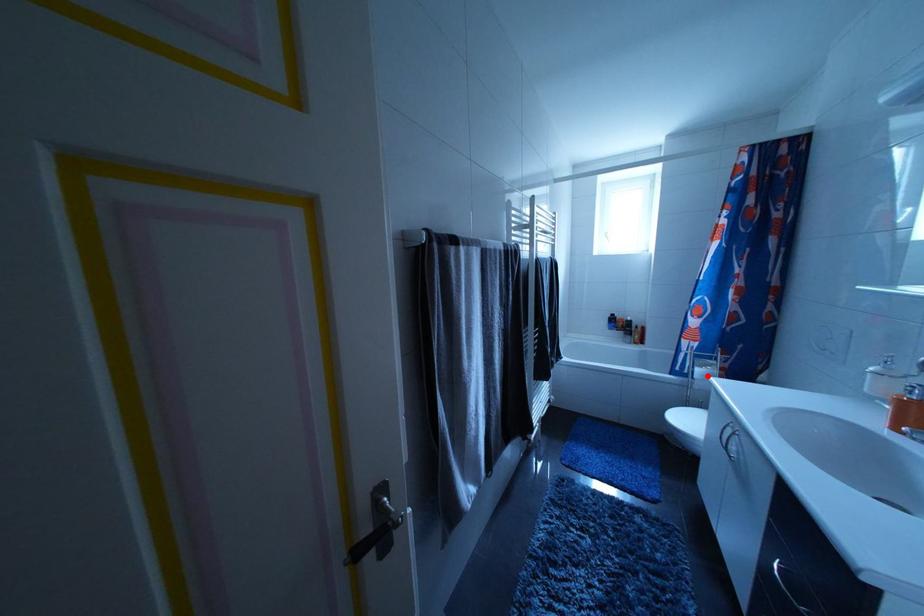
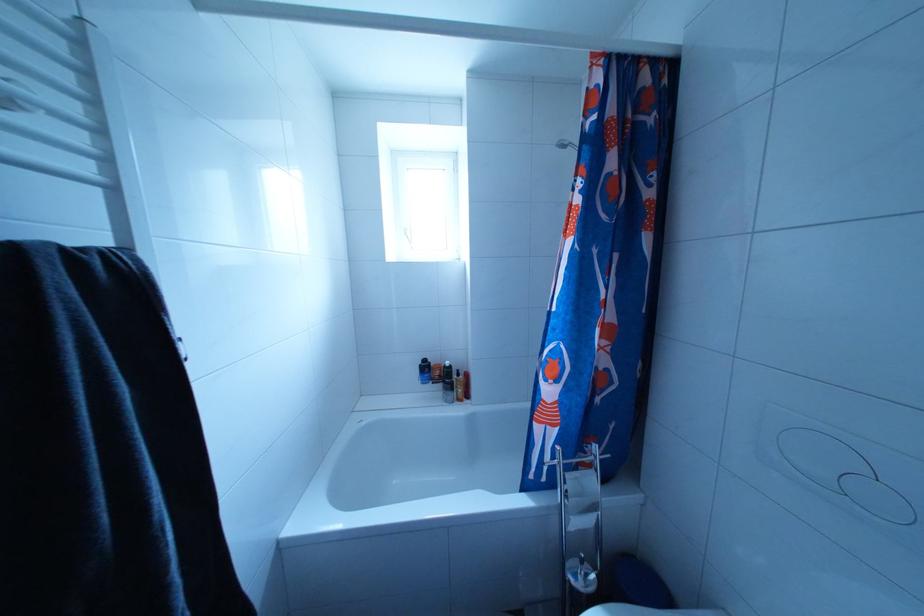
Question: I am providing you with two images of the same scene from different viewpoints. A red point is shown in image1. For the corresponding object point in image2, is it positioned nearer or farther from the camera?

Choices:
 (A) Nearer
 (B) Farther

Answer: (B)